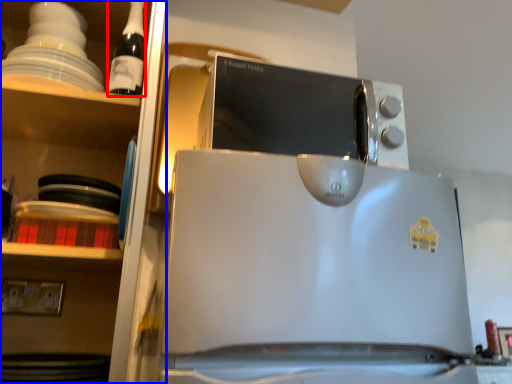
Question: Which of the following is the closest to the observer, bottle (highlighted by a red box) or shelf (highlighted by a blue box)?

Choices:
 (A) bottle
 (B) shelf

Answer: (B)